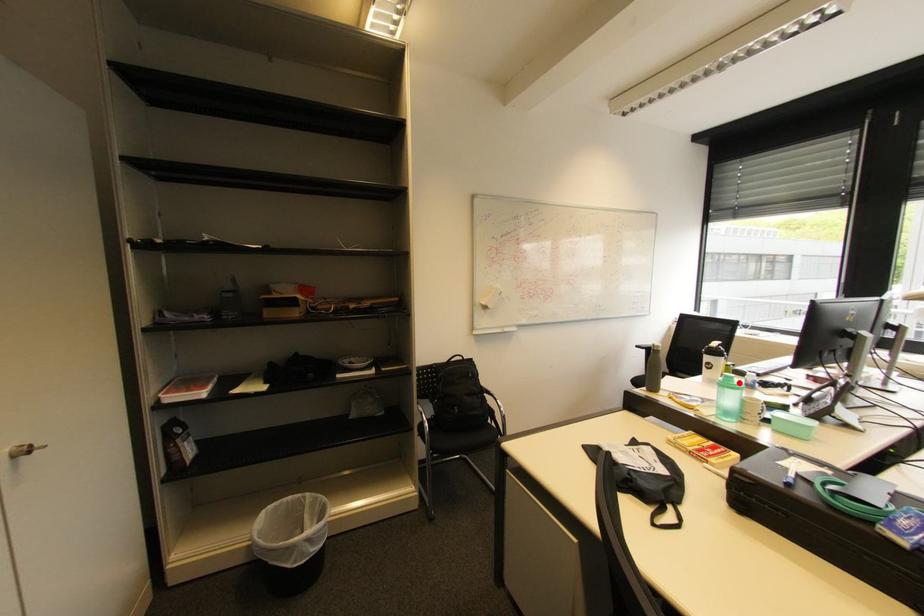
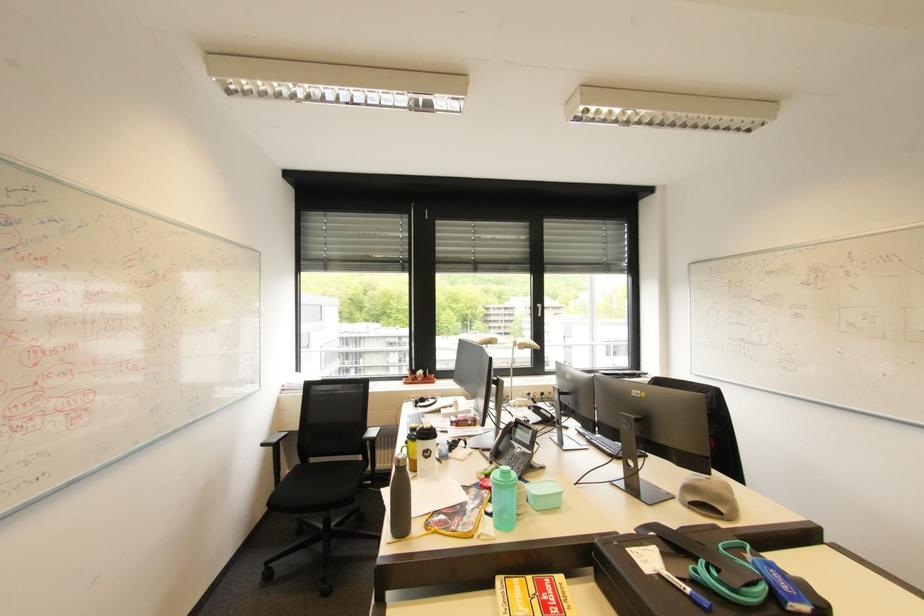
Question: I am providing you with two images of the same scene from different viewpoints. A red point is marked on the first image. Is the red point's position out of view in image 2?

Choices:
 (A) Yes
 (B) No

Answer: (B)